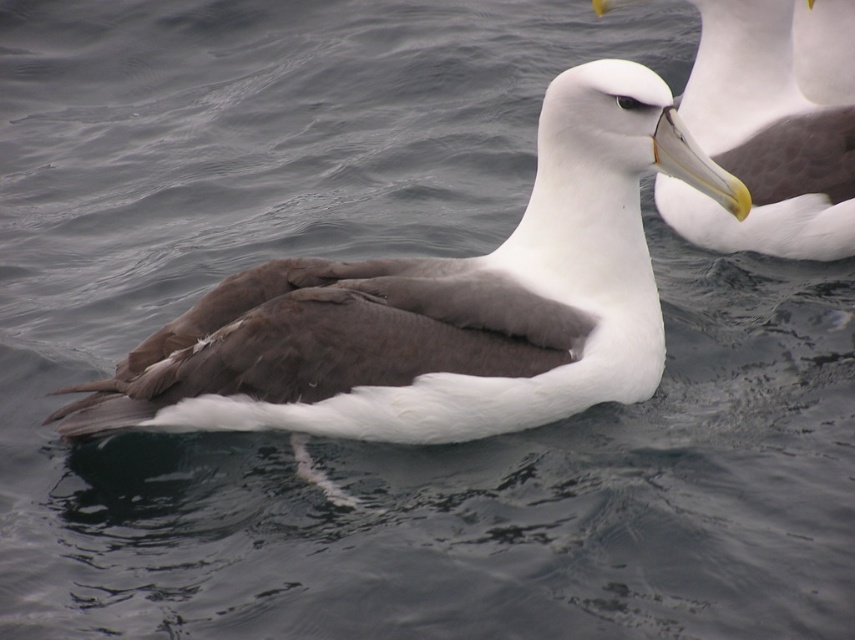
You are a wildlife photographer observing the scene. You need to capture a photo where the white matte bird at center is clearly visible above the white glossy beak at upper center. Based on their sizes, is this possible?

The white matte bird at center has a greater height compared to the white glossy beak at upper center, so it is possible to capture a photo where the white matte bird at center is clearly visible above the white glossy beak at upper center.

You are a wildlife photographer aiming to capture the white matte bird at center and the white glossy beak at upper center in your shot. If you want to ensure both are fully visible in your frame, which object should you focus on first?

Since the white matte bird at center might be wider than the white glossy beak at upper center, you should focus on the white matte bird at center first to ensure it fits entirely within the frame before adjusting for the smaller beak.

You are a photographer trying to capture the black albatross in the scene. You notice two points marked in the image. The first point is at coordinates point (441, 356) and the second at point (800, 225). Which point is closer to the photographer?

Point (441, 356) is in front of point (800, 225), so the first point is closer to the photographer.